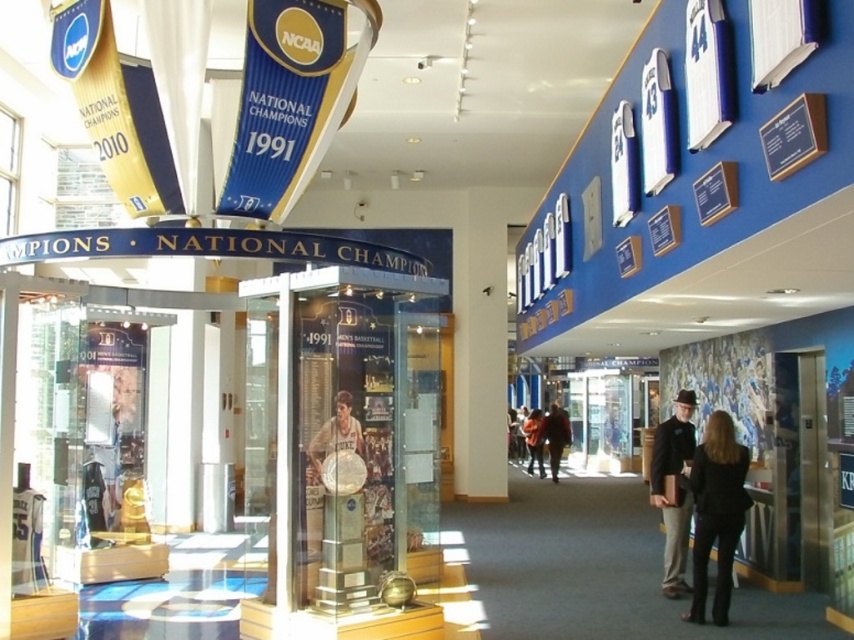
You are a museum visitor standing in the hallway. You notice the matte gold trophy at center and the orange fabric jacket at center. Which object is narrower when viewed from the front?

The matte gold trophy at center is thinner than the orange fabric jacket at center, so the matte gold trophy at center is narrower when viewed from the front.

In the scene shown: You are standing in the hallway of the sports museum. You see two points marked on the wall at coordinates point (x=316, y=440) and point (x=541, y=433). Which point is closer to you?

Point (x=316, y=440) is closer to the viewer than point (x=541, y=433).